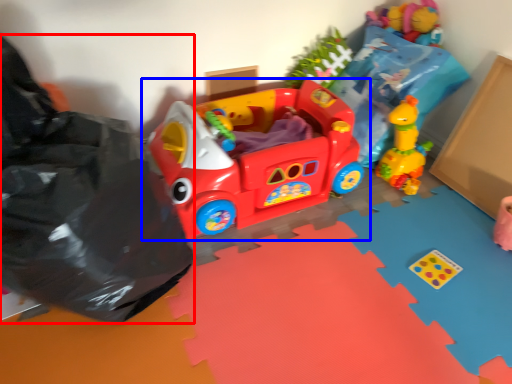
Question: Among these objects, which one is farthest to the camera, garbage (highlighted by a red box) or toy (highlighted by a blue box)?

Choices:
 (A) garbage
 (B) toy

Answer: (B)